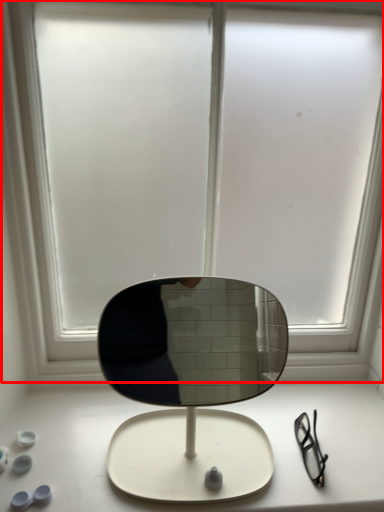
Question: From the image, what is the correct spatial relationship of window (annotated by the red box) in relation to table top?

Choices:
 (A) right
 (B) left

Answer: (A)